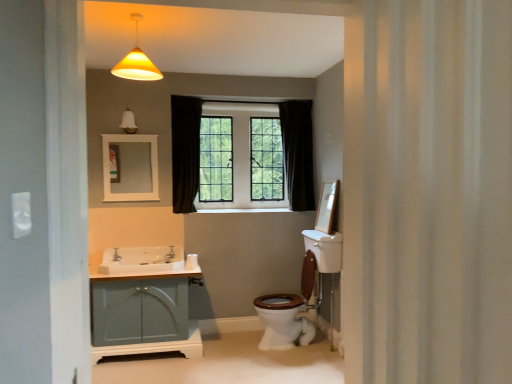
The image size is (512, 384). I want to click on vacant area that is in front of brushed metal faucet at sink left, arranged as the 1th faucet when viewed from the back, so click(x=163, y=260).